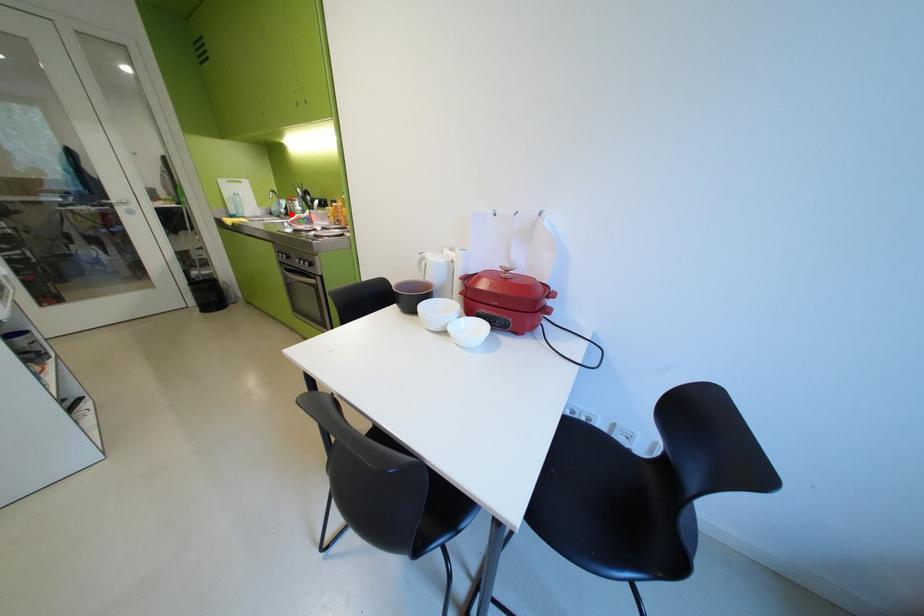
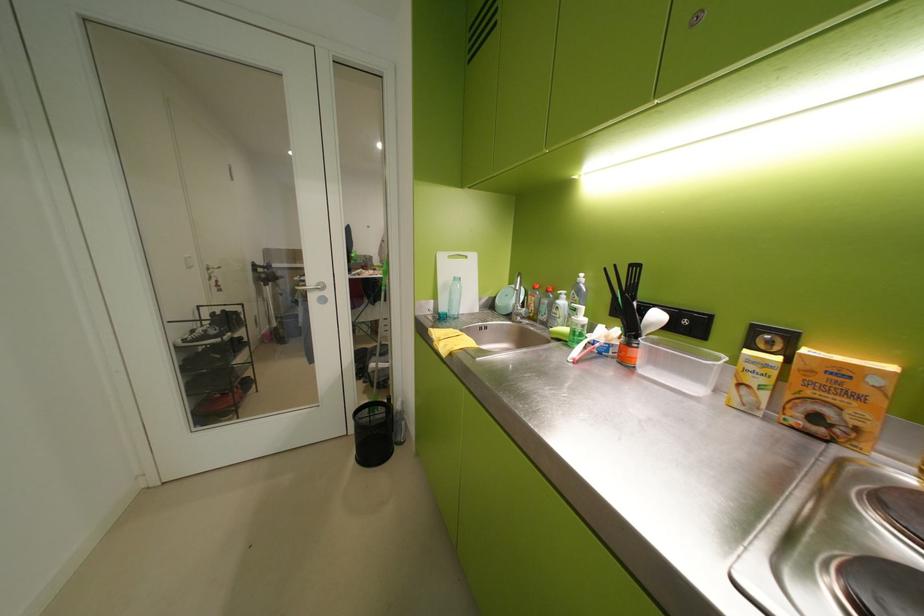
Find the pixel in the second image that matches the highlighted location in the first image.

(529, 315)